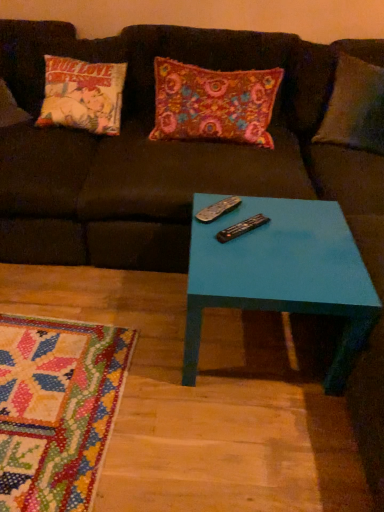
Question: Should I look upward or downward to see teal glossy table at center?

Choices:
 (A) up
 (B) down

Answer: (B)

Question: Does black plastic remote at center, arranged as the 1th remote when viewed from the back, come in front of floral fabric pillow at center?

Choices:
 (A) yes
 (B) no

Answer: (A)

Question: Does black plastic remote at center, which is counted as the 2th remote, starting from the front, appear on the right side of floral fabric pillow at center?

Choices:
 (A) yes
 (B) no

Answer: (A)

Question: Can you confirm if black plastic remote at center, which is counted as the 2th remote, starting from the front, is bigger than floral fabric pillow at center?

Choices:
 (A) no
 (B) yes

Answer: (A)

Question: Is black plastic remote at center, which is counted as the 2th remote, starting from the front, in contact with floral fabric pillow at center?

Choices:
 (A) yes
 (B) no

Answer: (B)

Question: From the image's perspective, is black plastic remote at center, which is counted as the 2th remote, starting from the front, on top of floral fabric pillow at center?

Choices:
 (A) no
 (B) yes

Answer: (A)

Question: Does black plastic remote at center, arranged as the 1th remote when viewed from the back, have a lesser height compared to floral fabric pillow at center?

Choices:
 (A) yes
 (B) no

Answer: (A)

Question: Would you say floral fabric pillow at center contains black plastic remote at center, the 2th remote in the back-to-front sequence?

Choices:
 (A) yes
 (B) no

Answer: (B)

Question: Is floral fabric pillow at center further to camera compared to black plastic remote at center, the 2th remote in the back-to-front sequence?

Choices:
 (A) no
 (B) yes

Answer: (B)

Question: Does floral fabric pillow at center come in front of black plastic remote at center, the 2th remote in the back-to-front sequence?

Choices:
 (A) yes
 (B) no

Answer: (B)

Question: From a real-world perspective, is floral fabric pillow at center located higher than black plastic remote at center, which is the first remote in front-to-back order?

Choices:
 (A) yes
 (B) no

Answer: (A)

Question: Considering the relative sizes of floral fabric pillow at center and black plastic remote at center, which is the first remote in front-to-back order, in the image provided, is floral fabric pillow at center bigger than black plastic remote at center, which is the first remote in front-to-back order,?

Choices:
 (A) yes
 (B) no

Answer: (A)

Question: From the image's perspective, is floral fabric pillow at center beneath black plastic remote at center, which is the first remote in front-to-back order?

Choices:
 (A) no
 (B) yes

Answer: (A)

Question: Is floral fabric pillow at center to the right of black plastic remote at center, which is counted as the 2th remote, starting from the front, from the viewer's perspective?

Choices:
 (A) no
 (B) yes

Answer: (A)